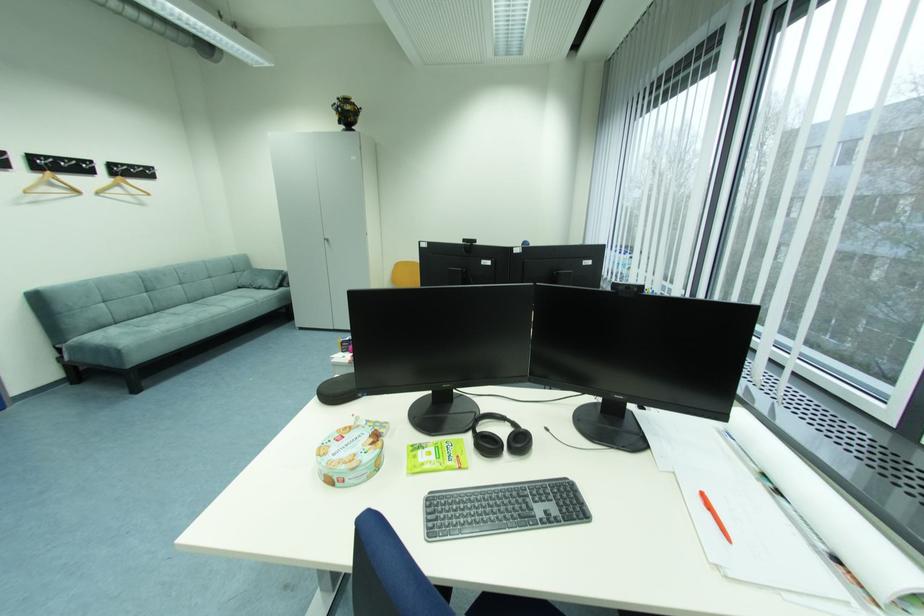
Image resolution: width=924 pixels, height=616 pixels. Find the location of `green snack packet`. green snack packet is located at coordinates (435, 456).